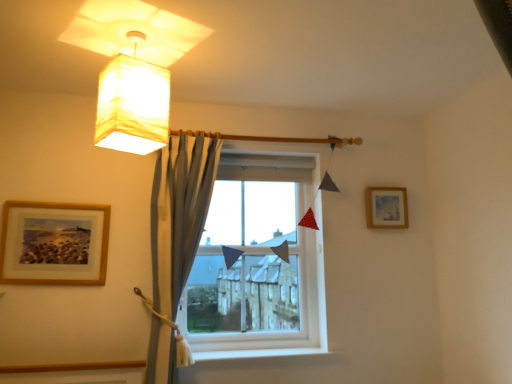
Describe the element at coordinates (54, 243) in the screenshot. I see `wooden picture frame at left, the second picture frame viewed from the right` at that location.

What do you see at coordinates (258, 262) in the screenshot? Image resolution: width=512 pixels, height=384 pixels. I see `clear glass window at center` at bounding box center [258, 262].

The image size is (512, 384). I want to click on clear glass window at center, so click(258, 262).

This screenshot has height=384, width=512. I want to click on matte yellow fabric lampshade at upper left, so click(x=133, y=103).

Locate an element on the screen. The height and width of the screenshot is (384, 512). wooden picture frame at left, the first picture frame in the front-to-back sequence is located at coordinates (54, 243).

From a real-world perspective, is matte yellow fabric lampshade at upper left physically above satin blue curtain at center?

Yes, from a real-world perspective, matte yellow fabric lampshade at upper left is on top of satin blue curtain at center.

Looking at this image, can we say matte yellow fabric lampshade at upper left lies outside satin blue curtain at center?

Yes, matte yellow fabric lampshade at upper left is located beyond the bounds of satin blue curtain at center.

Is matte yellow fabric lampshade at upper left positioned behind satin blue curtain at center?

No, matte yellow fabric lampshade at upper left is closer to the viewer.

Is matte yellow fabric lampshade at upper left in contact with satin blue curtain at center?

They are not placed beside each other.

Which of these two, wooden framed picture at upper right, acting as the 1th picture frame starting from the back, or clear glass window at center, is smaller?

With smaller size is wooden framed picture at upper right, acting as the 1th picture frame starting from the back.

Is wooden framed picture at upper right, which is the second picture frame from front to back, far from clear glass window at center?

No, there isn't a large distance between wooden framed picture at upper right, which is the second picture frame from front to back, and clear glass window at center.

Does point (393, 194) lie in front of point (245, 168)?

Yes, point (393, 194) is in front of point (245, 168).

From the image's perspective, which is above, wooden framed picture at upper right, the second picture frame when ordered from left to right, or clear glass window at center?

wooden framed picture at upper right, the second picture frame when ordered from left to right, from the image's perspective.

Which object is closer to the camera, satin blue curtain at center or wooden framed picture at upper right, which is the second picture frame from front to back?

satin blue curtain at center is in front.

Is satin blue curtain at center not near wooden framed picture at upper right, marked as the 1th picture frame in a right-to-left arrangement?

That's right, there is a large distance between satin blue curtain at center and wooden framed picture at upper right, marked as the 1th picture frame in a right-to-left arrangement.

From the image's perspective, is satin blue curtain at center on wooden framed picture at upper right, acting as the 1th picture frame starting from the back?

No, from the image's perspective, satin blue curtain at center is not over wooden framed picture at upper right, acting as the 1th picture frame starting from the back.

Considering the sizes of objects matte yellow fabric lampshade at upper left and clear glass window at center in the image provided, who is taller, matte yellow fabric lampshade at upper left or clear glass window at center?

clear glass window at center is taller.

Considering the positions of objects matte yellow fabric lampshade at upper left and clear glass window at center in the image provided, who is more to the right, matte yellow fabric lampshade at upper left or clear glass window at center?

clear glass window at center is more to the right.

Is point (144, 120) positioned in front of point (318, 249)?

Yes, point (144, 120) is in front of point (318, 249).

Is matte yellow fabric lampshade at upper left in front of or behind clear glass window at center in the image?

Visually, matte yellow fabric lampshade at upper left is located in front of clear glass window at center.

From the image's perspective, is satin blue curtain at center beneath clear glass window at center?

Actually, satin blue curtain at center appears above clear glass window at center in the image.

Can you confirm if satin blue curtain at center is positioned to the left of clear glass window at center?

Yes, satin blue curtain at center is to the left of clear glass window at center.

Does satin blue curtain at center have a greater width compared to clear glass window at center?

Correct, the width of satin blue curtain at center exceeds that of clear glass window at center.

Which of these two, satin blue curtain at center or clear glass window at center, stands taller?

Standing taller between the two is satin blue curtain at center.

From the image's perspective, is clear glass window at center on wooden picture frame at left, positioned as the first picture frame in left-to-right order?

Actually, clear glass window at center appears below wooden picture frame at left, positioned as the first picture frame in left-to-right order, in the image.

Between clear glass window at center and wooden picture frame at left, the first picture frame in the front-to-back sequence, which one has more height?

clear glass window at center is taller.

Is clear glass window at center facing away from wooden picture frame at left, the second picture frame viewed from the right?

No, clear glass window at center is not facing the opposite direction of wooden picture frame at left, the second picture frame viewed from the right.

Does point (315, 155) lie behind point (53, 250)?

Yes, it is behind point (53, 250).

In the scene shown: Between wooden picture frame at left, which is counted as the second picture frame, starting from the back, and matte yellow fabric lampshade at upper left, which one has smaller width?

Thinner between the two is wooden picture frame at left, which is counted as the second picture frame, starting from the back.

From the image's perspective, who appears lower, wooden picture frame at left, the first picture frame in the front-to-back sequence, or matte yellow fabric lampshade at upper left?

From the image's view, wooden picture frame at left, the first picture frame in the front-to-back sequence, is below.

Which is behind, wooden picture frame at left, which is counted as the second picture frame, starting from the back, or matte yellow fabric lampshade at upper left?

wooden picture frame at left, which is counted as the second picture frame, starting from the back, is more distant.

Can you confirm if wooden picture frame at left, which is counted as the second picture frame, starting from the back, is positioned to the right of matte yellow fabric lampshade at upper left?

Incorrect, wooden picture frame at left, which is counted as the second picture frame, starting from the back, is not on the right side of matte yellow fabric lampshade at upper left.

Where is `lamp in front of the satin blue curtain at center`? This screenshot has width=512, height=384. lamp in front of the satin blue curtain at center is located at coordinates (133, 103).

From a real-world perspective, starting from the clear glass window at center, which picture frame is the 2nd one vertically above it? Please provide its 2D coordinates.

[(386, 207)]

When comparing their distances from wooden picture frame at left, positioned as the first picture frame in left-to-right order, does satin blue curtain at center or matte yellow fabric lampshade at upper left seem further?

matte yellow fabric lampshade at upper left is positioned further to the anchor wooden picture frame at left, positioned as the first picture frame in left-to-right order.

When comparing their distances from matte yellow fabric lampshade at upper left, does wooden framed picture at upper right, marked as the 1th picture frame in a right-to-left arrangement, or wooden picture frame at left, positioned as the first picture frame in left-to-right order, seem closer?

Based on the image, wooden picture frame at left, positioned as the first picture frame in left-to-right order, appears to be nearer to matte yellow fabric lampshade at upper left.

Looking at this image, which object lies nearer to the anchor point wooden picture frame at left, positioned as the first picture frame in left-to-right order, matte yellow fabric lampshade at upper left or wooden framed picture at upper right, marked as the 1th picture frame in a right-to-left arrangement?

The object closer to wooden picture frame at left, positioned as the first picture frame in left-to-right order, is matte yellow fabric lampshade at upper left.

Based on their spatial positions, is wooden picture frame at left, the first picture frame in the front-to-back sequence, or clear glass window at center closer to wooden framed picture at upper right, acting as the 1th picture frame starting from the back?

Among the two, clear glass window at center is located nearer to wooden framed picture at upper right, acting as the 1th picture frame starting from the back.

When comparing their distances from matte yellow fabric lampshade at upper left, does satin blue curtain at center or wooden framed picture at upper right, marked as the 1th picture frame in a right-to-left arrangement, seem further?

wooden framed picture at upper right, marked as the 1th picture frame in a right-to-left arrangement, is positioned further to the anchor matte yellow fabric lampshade at upper left.

Considering their positions, is matte yellow fabric lampshade at upper left positioned further to satin blue curtain at center than clear glass window at center?

matte yellow fabric lampshade at upper left is further to satin blue curtain at center.

Based on their spatial positions, is wooden framed picture at upper right, the second picture frame when ordered from left to right, or wooden picture frame at left, the first picture frame in the front-to-back sequence, further from clear glass window at center?

wooden picture frame at left, the first picture frame in the front-to-back sequence, is further to clear glass window at center.

From the image, which object appears to be nearer to wooden picture frame at left, the first picture frame in the front-to-back sequence, clear glass window at center or matte yellow fabric lampshade at upper left?

Among the two, matte yellow fabric lampshade at upper left is located nearer to wooden picture frame at left, the first picture frame in the front-to-back sequence.

I want to click on curtain situated between wooden picture frame at left, the first picture frame in the front-to-back sequence, and clear glass window at center from left to right, so click(x=179, y=213).

The width and height of the screenshot is (512, 384). I want to click on window situated between satin blue curtain at center and wooden framed picture at upper right, acting as the 1th picture frame starting from the back, from left to right, so click(258, 262).

Locate an element on the screen. curtain between matte yellow fabric lampshade at upper left and clear glass window at center in the up-down direction is located at coordinates (179, 213).

In order to click on curtain located between matte yellow fabric lampshade at upper left and wooden framed picture at upper right, the second picture frame when ordered from left to right, in the left-right direction in this screenshot , I will do `click(179, 213)`.